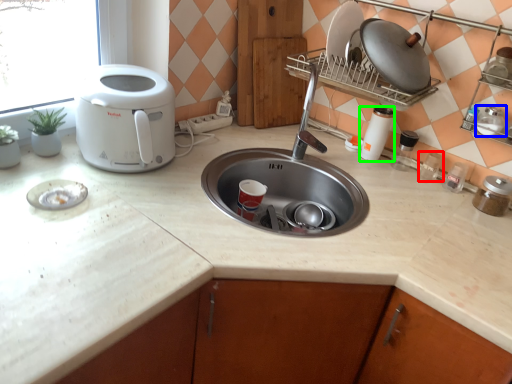
Question: Which is nearer to the appliance (highlighted by a red box)? appliance (highlighted by a blue box) or appliance (highlighted by a green box).

Choices:
 (A) appliance
 (B) appliance

Answer: (B)